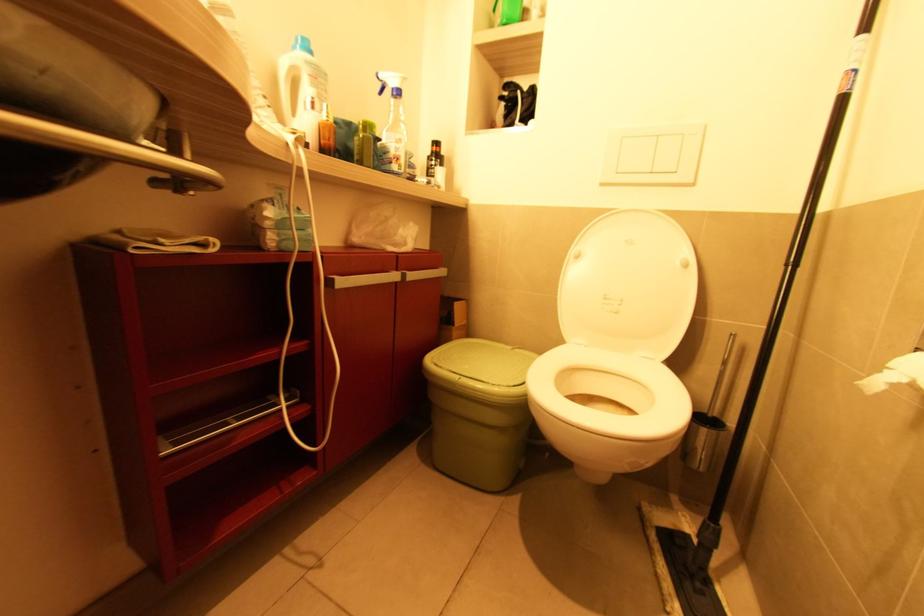
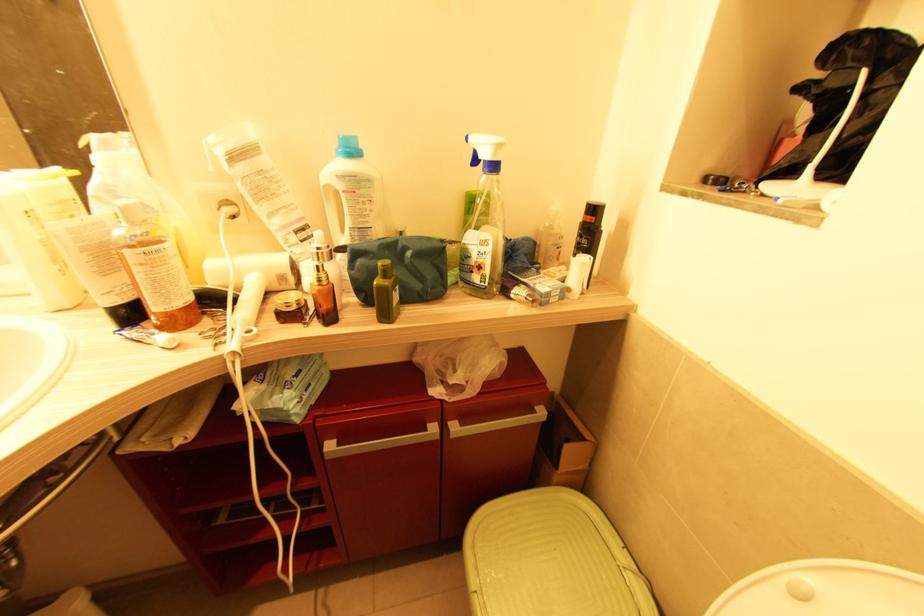
Where in the second image is the point corresponding to (393,163) from the first image?

(473, 273)